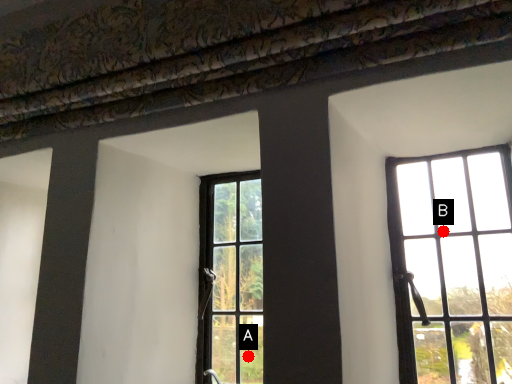
Question: Two points are circled on the image, labeled by A and B beside each circle. Which of the following is the closest to the observer?

Choices:
 (A) A is closer
 (B) B is closer

Answer: (B)